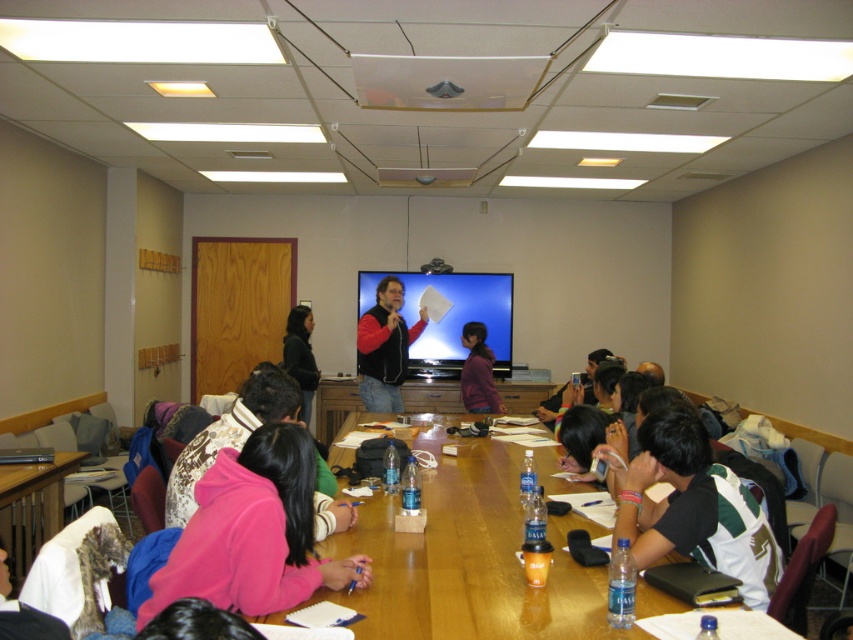
Can you confirm if wooden table at lower left is wider than black plastic projector at upper center?

Yes.

Which is behind, point (39, 496) or point (448, 266)?

Positioned behind is point (448, 266).

This screenshot has height=640, width=853. I want to click on wooden table at lower left, so click(32, 506).

Based on the photo, does pink fleece jacket at lower center have a lesser height compared to wooden table at lower left?

Indeed, pink fleece jacket at lower center has a lesser height compared to wooden table at lower left.

Based on the photo, does pink fleece jacket at lower center have a greater width compared to wooden table at lower left?

Correct, the width of pink fleece jacket at lower center exceeds that of wooden table at lower left.

Is point (242, 499) positioned before point (21, 492)?

Yes.

The image size is (853, 640). I want to click on pink fleece jacket at lower center, so click(253, 532).

Who is more forward, (383, 392) or (312, 380)?

Point (383, 392) is more forward.

Which is behind, point (384, 296) or point (289, 364)?

The point (289, 364) is more distant.

The height and width of the screenshot is (640, 853). In order to click on matte black vest at center in this screenshot , I will do `click(386, 348)`.